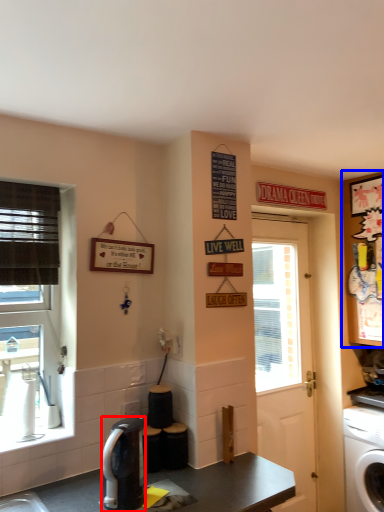
Question: Which object is further to the camera taking this photo, coffee maker (highlighted by a red box) or cabinetry (highlighted by a blue box)?

Choices:
 (A) coffee maker
 (B) cabinetry

Answer: (B)